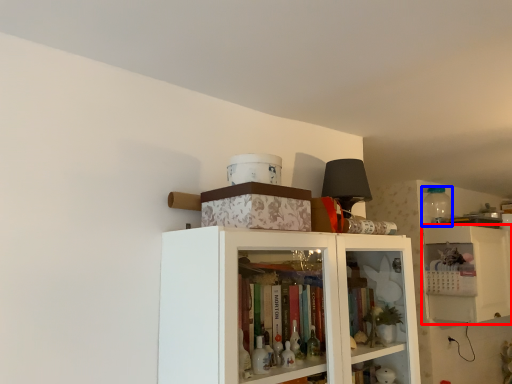
Question: Which object is closer to the camera taking this photo, cabinetry (highlighted by a red box) or bottle (highlighted by a blue box)?

Choices:
 (A) cabinetry
 (B) bottle

Answer: (A)